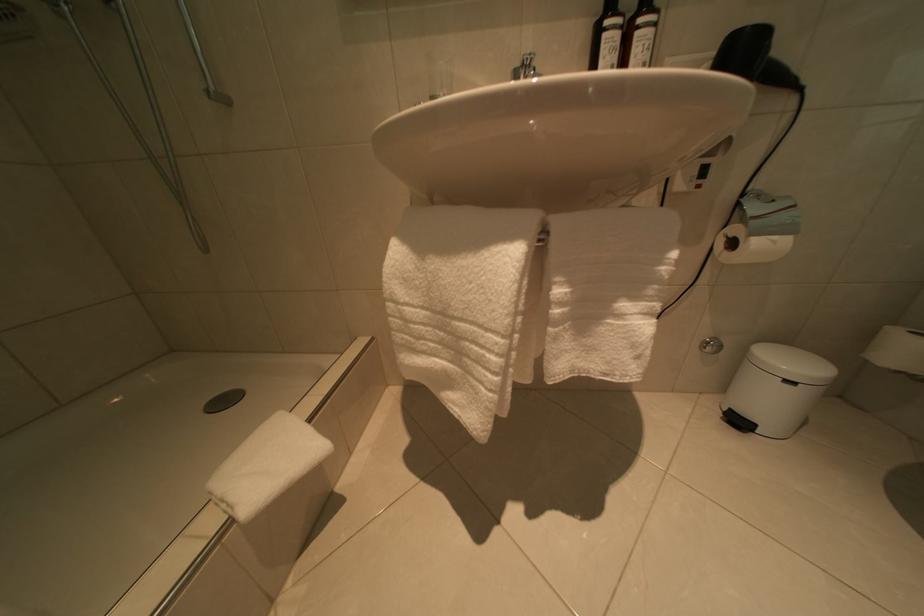
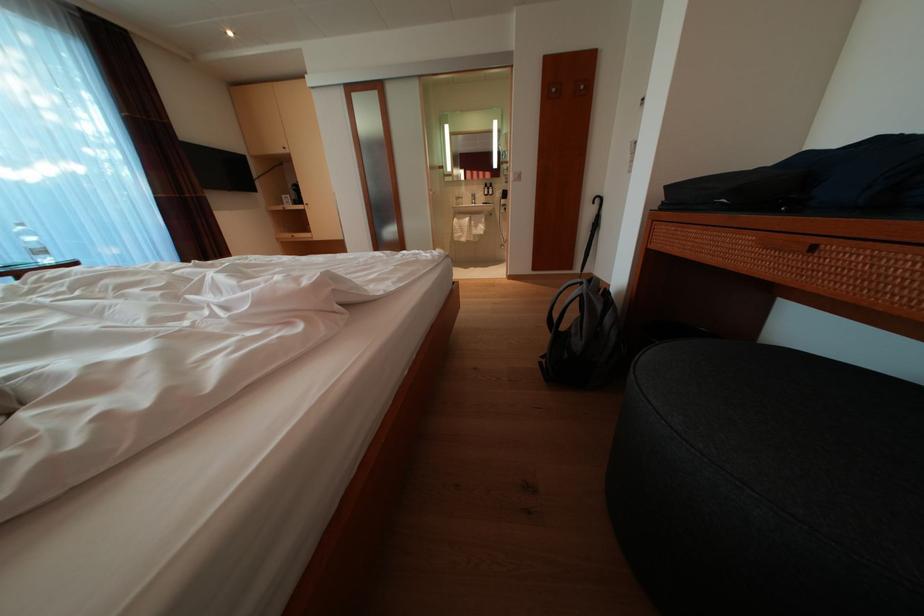
Question: Which direction would the cameraman need to move to produce the second image? Reply with the corresponding letter.

Choices:
 (A) Left
 (B) Right
 (C) Forward
 (D) Backward

Answer: (D)